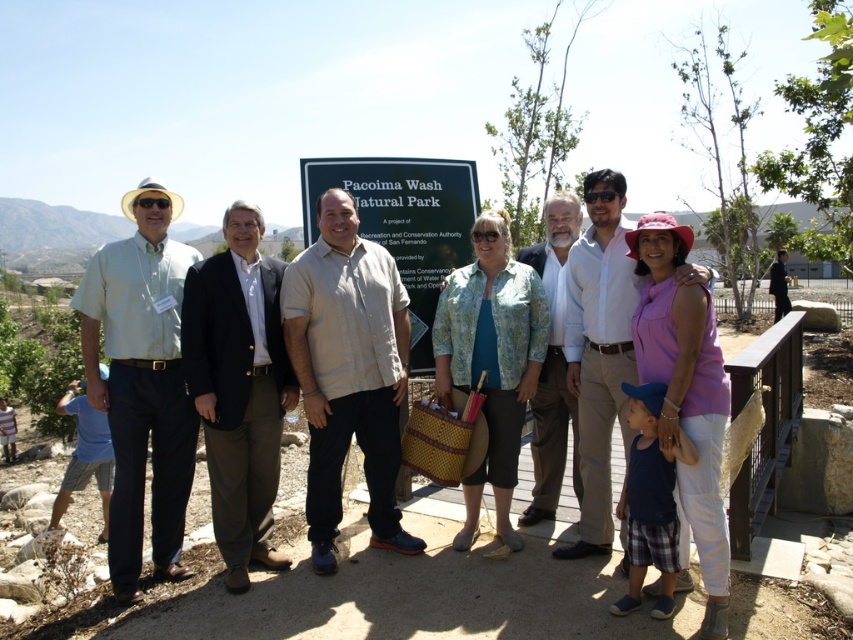
Who is lower down, black wool suit at center or light blue shirt at center?

black wool suit at center

Does black wool suit at center have a lesser width compared to light blue shirt at center?

In fact, black wool suit at center might be wider than light blue shirt at center.

Locate an element on the screen. This screenshot has width=853, height=640. black wool suit at center is located at coordinates (239, 387).

I want to click on black wool suit at center, so click(x=239, y=387).

Which of these two, matte beige shirt at center or light blue shirt at left, stands shorter?

matte beige shirt at center is shorter.

Is matte beige shirt at center further to camera compared to light blue shirt at left?

Yes, it is.

This screenshot has width=853, height=640. Identify the location of matte beige shirt at center. (343, 380).

Who is positioned more to the left, matte beige shirt at center or beige cotton shirt at center?

beige cotton shirt at center

Who is positioned more to the right, matte beige shirt at center or beige cotton shirt at center?

From the viewer's perspective, matte beige shirt at center appears more on the right side.

Is point (372, 529) closer to camera compared to point (329, 525)?

That is False.

At what (x,y) coordinates should I click in order to perform the action: click on matte beige shirt at center. Please return your answer as a coordinate pair (x, y). The image size is (853, 640). Looking at the image, I should click on tap(343, 380).